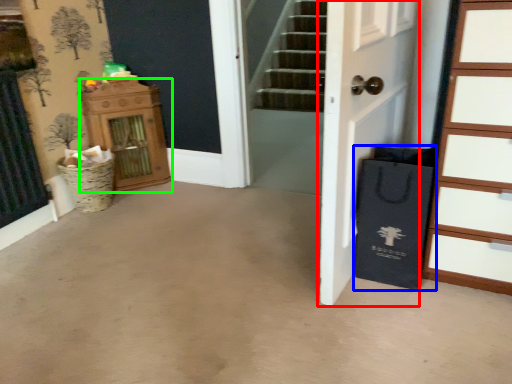
Question: Based on their relative distances, which object is nearer to door (highlighted by a red box)? Choose from shopping bag (highlighted by a blue box) and dresser (highlighted by a green box).

Choices:
 (A) shopping bag
 (B) dresser

Answer: (A)